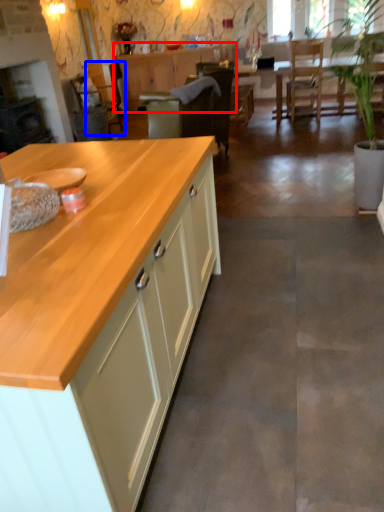
Question: Which of the following is the closest to the observer, cabinetry (highlighted by a red box) or armchair (highlighted by a blue box)?

Choices:
 (A) cabinetry
 (B) armchair

Answer: (B)